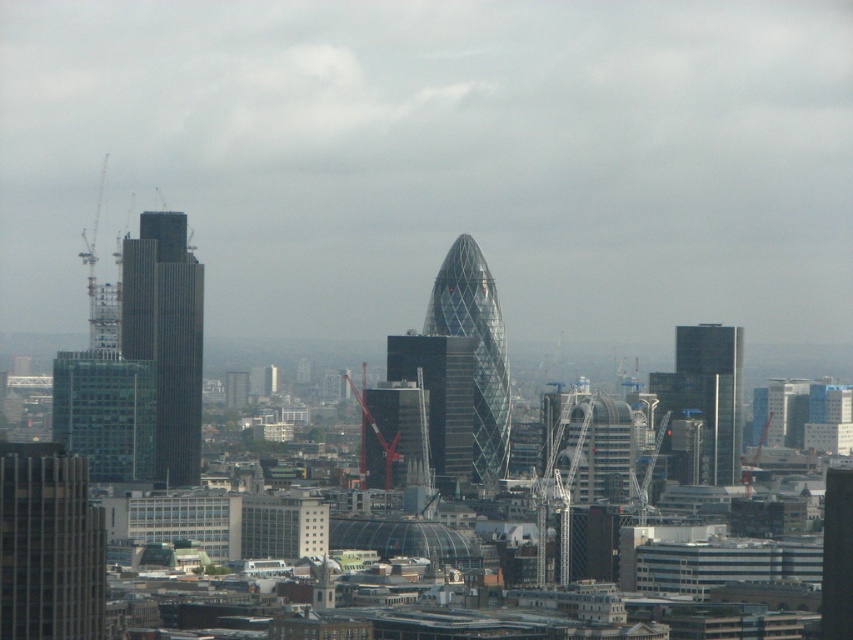
Question: Based on their relative distances, which object is farther from the glass skyscraper at center?

Choices:
 (A) glassy reflective skyscraper at center
 (B) glassy reflective skyscraper at center-right
 (C) glassy steel tower at center

Answer: (B)

Question: In this image, where is glassy steel tower at center located relative to glassy reflective skyscraper at center?

Choices:
 (A) above
 (B) below

Answer: (A)

Question: Which of these objects is positioned closest to the glassy steel tower at center?

Choices:
 (A) glassy reflective skyscraper at center-right
 (B) glass skyscraper at center
 (C) glassy reflective skyscraper at center
 (D) dark glass skyscraper at left

Answer: (C)

Question: Where is glassy skyscraper at lower left located in relation to glassy reflective skyscraper at center-right in the image?

Choices:
 (A) above
 (B) below

Answer: (B)

Question: Does dark glass skyscraper at left have a greater width compared to glass skyscraper at center?

Choices:
 (A) no
 (B) yes

Answer: (B)

Question: Which object is closer to the camera taking this photo?

Choices:
 (A) glassy reflective skyscraper at center
 (B) dark glass skyscraper at left

Answer: (A)